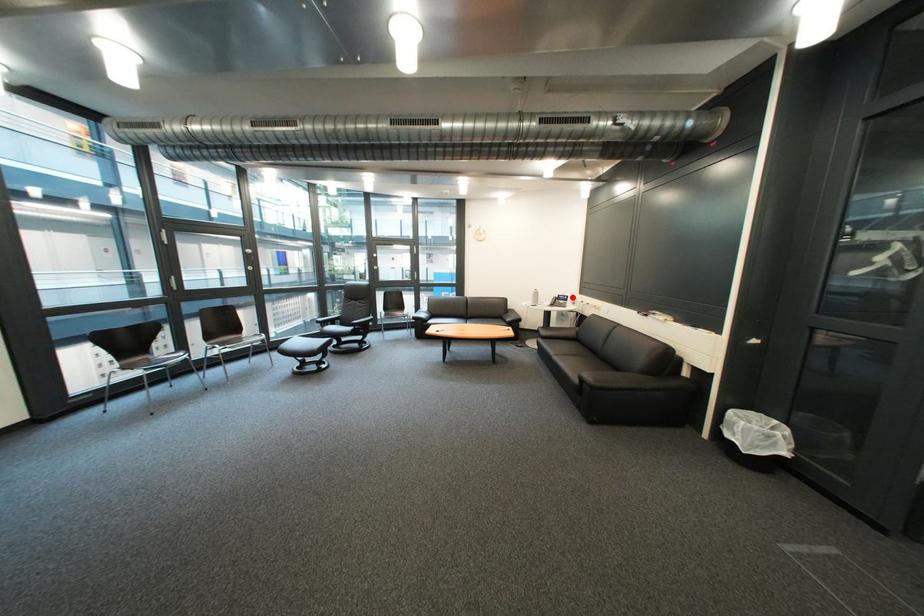
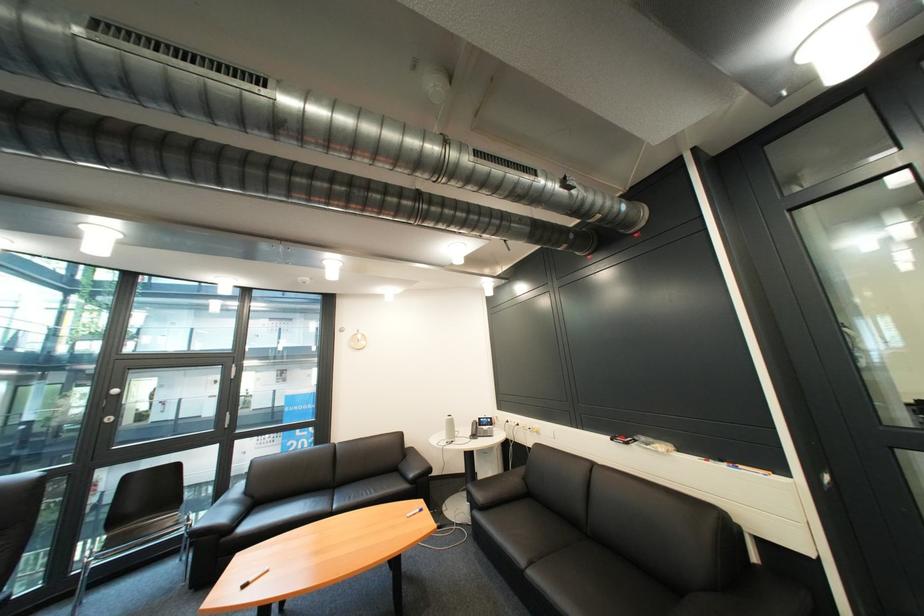
Question: I am providing you with two images of the same scene from different viewpoints. In image1, a red point is highlighted. Considering the same 3D point in image2, which of the following is correct?

Choices:
 (A) It is closer
 (B) It is farther

Answer: (B)